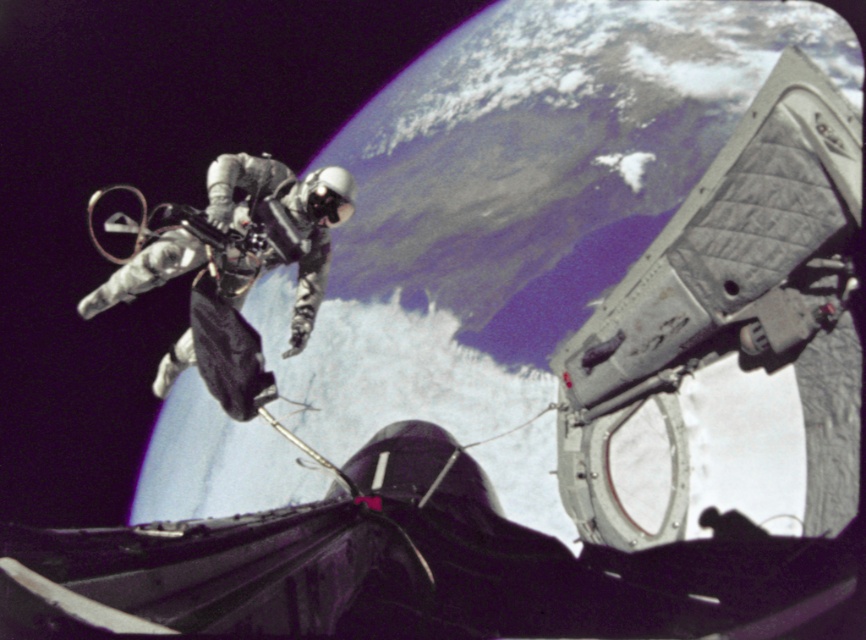
Who is more distant from viewer, (x=713, y=225) or (x=234, y=176)?

The point (x=234, y=176) is behind.

Describe the element at coordinates (731, 308) in the screenshot. I see `gray quilted fabric at upper right` at that location.

Where is `gray quilted fabric at upper right`? This screenshot has width=866, height=640. gray quilted fabric at upper right is located at coordinates (731, 308).